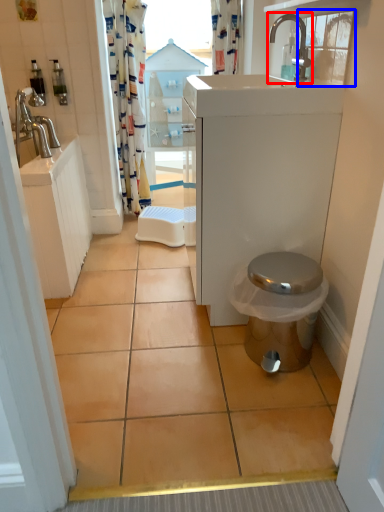
Question: Among these objects, which one is farthest to the camera, tap (highlighted by a red box) or window (highlighted by a blue box)?

Choices:
 (A) tap
 (B) window

Answer: (A)